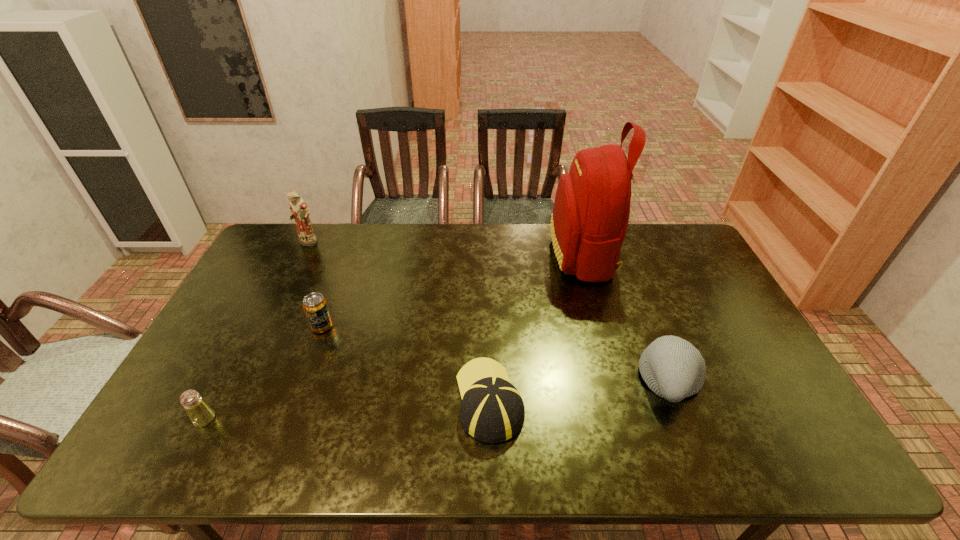
At what (x,y) coordinates should I click in order to perform the action: click on vacant space in between the third object from right to left and the soda can. Please return your answer as a coordinate pair (x, y). The height and width of the screenshot is (540, 960). Looking at the image, I should click on point(406,363).

You are a GUI agent. You are given a task and a screenshot of the screen. Output one action in this format:
    pyautogui.click(x=<x>, y=<y>)
    Task: Click on the free space between the second tallest object and the fourth nearest object
    The image size is (960, 540).
    Given the screenshot: What is the action you would take?
    pyautogui.click(x=315, y=285)

You are a GUI agent. You are given a task and a screenshot of the screen. Output one action in this format:
    pyautogui.click(x=<x>, y=<y>)
    Task: Click on the free point between the saltshaker and the tallest object
    
    Given the screenshot: What is the action you would take?
    pyautogui.click(x=394, y=336)

This screenshot has width=960, height=540. In order to click on free space between the third object from right to left and the tallest object in this screenshot , I will do `click(536, 327)`.

At what (x,y) coordinates should I click in order to perform the action: click on free space that is in between the saltshaker and the tallest object. Please return your answer as a coordinate pair (x, y). This screenshot has height=540, width=960. Looking at the image, I should click on (394, 336).

I want to click on free spot between the saltshaker and the beanie, so click(438, 400).

Where is `unoccupied area between the beanie and the saltshaker`? unoccupied area between the beanie and the saltshaker is located at coordinates (438, 400).

Find the location of a particular element. This screenshot has width=960, height=540. free space between the saltshaker and the figurine is located at coordinates (256, 332).

The width and height of the screenshot is (960, 540). What are the coordinates of `free spot between the third farthest object and the saltshaker` in the screenshot? It's located at (263, 373).

Identify which object is the second nearest to the fourth object from right to left. Please provide its 2D coordinates. Your answer should be formatted as a tuple, i.e. [(x, y)], where the tuple contains the x and y coordinates of a point satisfying the conditions above.

[(299, 210)]